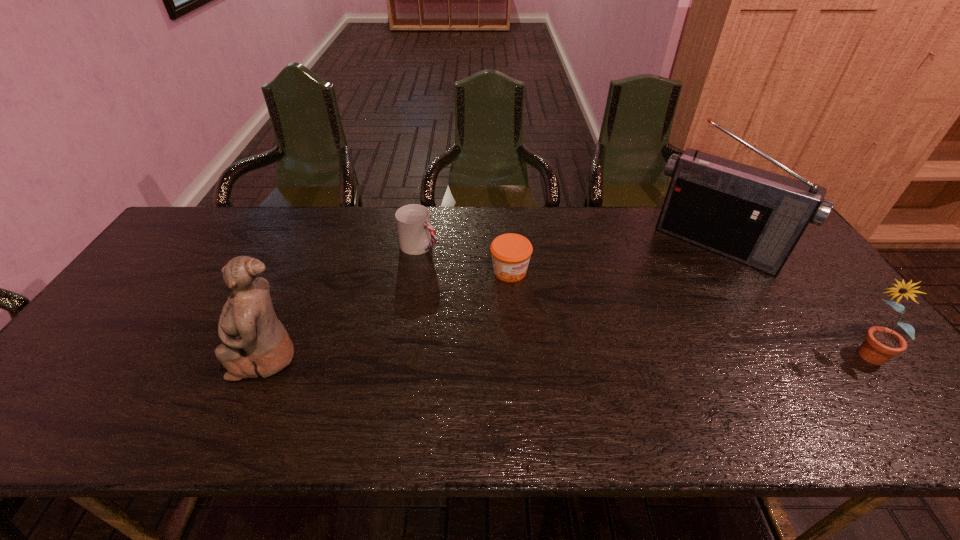
At what (x,y) coordinates should I click in order to perform the action: click on free spot on the desktop that is between the figurine and the third tallest object and is positioned on the front label of the jam. Please return your answer as a coordinate pair (x, y). Image resolution: width=960 pixels, height=540 pixels. Looking at the image, I should click on (600, 356).

Find the location of a particular element. This screenshot has width=960, height=540. free space on the desktop that is between the second tallest object and the third tallest object and is positioned on the handle side of the fourth tallest object is located at coordinates (601, 356).

Where is `vacant space on the desktop that is between the leftmost object and the third shortest object and is positioned on the front-facing side of the tallest object`? The width and height of the screenshot is (960, 540). vacant space on the desktop that is between the leftmost object and the third shortest object and is positioned on the front-facing side of the tallest object is located at coordinates point(644,356).